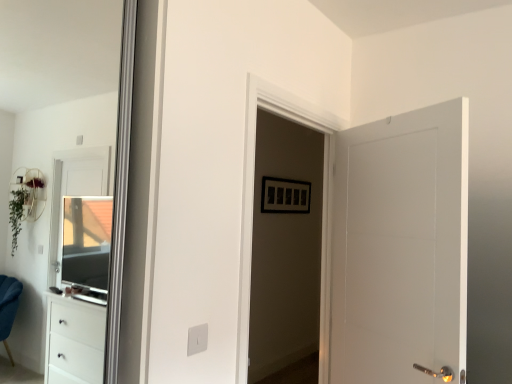
Question: Is white glossy door at center surrounding clear glass window at left?

Choices:
 (A) yes
 (B) no

Answer: (B)

Question: Is white glossy door at center not within clear glass window at left?

Choices:
 (A) no
 (B) yes

Answer: (B)

Question: From the image's perspective, would you say white glossy door at center is positioned over clear glass window at left?

Choices:
 (A) no
 (B) yes

Answer: (B)

Question: Are white glossy door at center and clear glass window at left located far from each other?

Choices:
 (A) no
 (B) yes

Answer: (B)

Question: From the image's perspective, is white glossy door at center under clear glass window at left?

Choices:
 (A) yes
 (B) no

Answer: (B)

Question: Is white glossy door at center at the left side of clear glass window at left?

Choices:
 (A) no
 (B) yes

Answer: (A)

Question: Is white matte door at right not within clear glass window at left?

Choices:
 (A) yes
 (B) no

Answer: (A)

Question: Is there a large distance between white matte door at right and clear glass window at left?

Choices:
 (A) no
 (B) yes

Answer: (B)

Question: Does white matte door at right have a smaller size compared to clear glass window at left?

Choices:
 (A) yes
 (B) no

Answer: (B)

Question: Is white matte door at right positioned in front of clear glass window at left?

Choices:
 (A) no
 (B) yes

Answer: (B)

Question: Considering the relative sizes of white matte door at right and clear glass window at left in the image provided, is white matte door at right taller than clear glass window at left?

Choices:
 (A) no
 (B) yes

Answer: (A)

Question: Is white matte door at right positioned with its back to clear glass window at left?

Choices:
 (A) yes
 (B) no

Answer: (B)

Question: Considering the relative sizes of white matte door at right and white glossy door at center in the image provided, is white matte door at right wider than white glossy door at center?

Choices:
 (A) no
 (B) yes

Answer: (B)